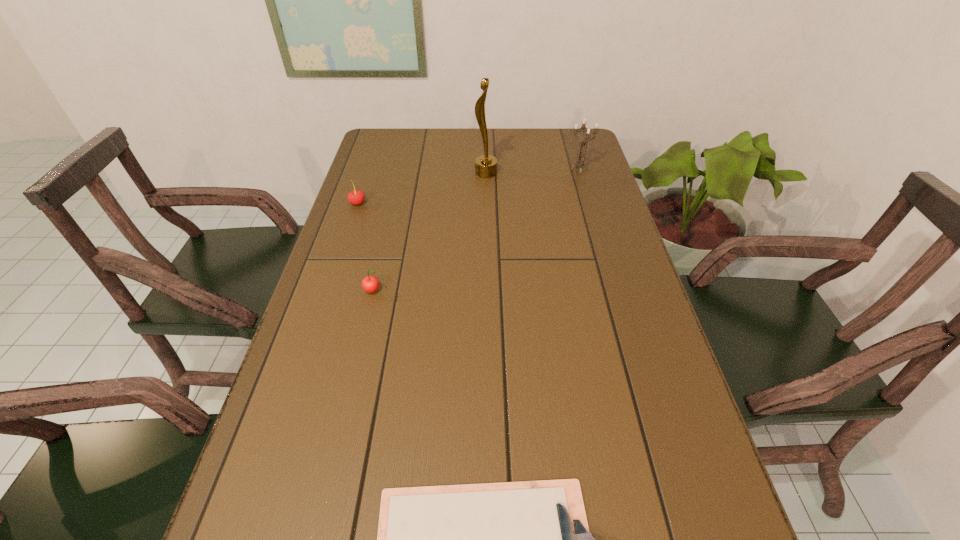
Find the location of a particular element. Image resolution: width=960 pixels, height=540 pixels. vacant area situated 0.200m on the back of the candle holder is located at coordinates (568, 136).

This screenshot has width=960, height=540. Find the location of `free region located 0.250m on the front of the farther cherry`. free region located 0.250m on the front of the farther cherry is located at coordinates (337, 264).

What are the coordinates of `vacant space situated 0.160m on the right of the second object from left to right` in the screenshot? It's located at (446, 291).

This screenshot has height=540, width=960. Find the location of `object that is at the right edge`. object that is at the right edge is located at coordinates (580, 162).

Locate an element on the screen. Image resolution: width=960 pixels, height=540 pixels. vacant space at the far edge of the desktop is located at coordinates (443, 131).

In the image, there is a desktop. Identify the location of vacant space at the left edge. The height and width of the screenshot is (540, 960). click(x=343, y=470).

In order to click on free region at the right edge of the desktop in this screenshot , I will do `click(575, 167)`.

In the image, there is a desktop. Identify the location of vacant region at the far left corner. Image resolution: width=960 pixels, height=540 pixels. (387, 130).

The width and height of the screenshot is (960, 540). Find the location of `free space at the far right corner`. free space at the far right corner is located at coordinates [575, 147].

Where is `vacant area that lies between the tallest object and the leftmost object`? The width and height of the screenshot is (960, 540). vacant area that lies between the tallest object and the leftmost object is located at coordinates (421, 188).